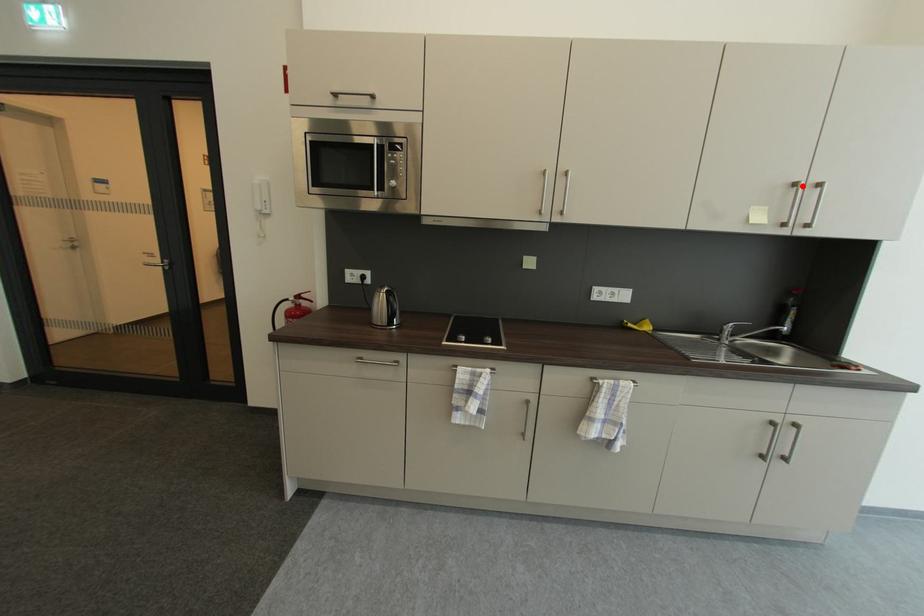
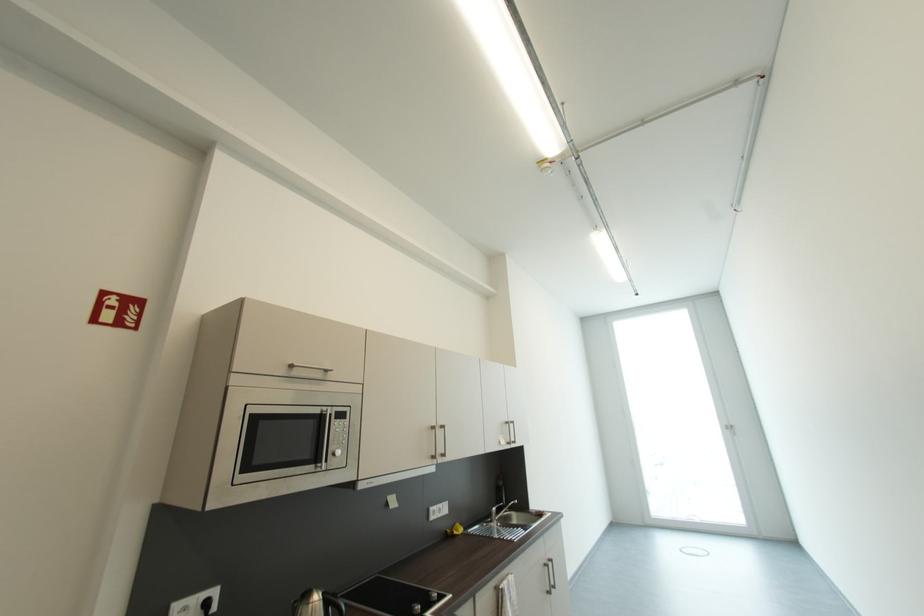
The point at the highlighted location is marked in the first image. Where is the corresponding point in the second image?

(513, 424)